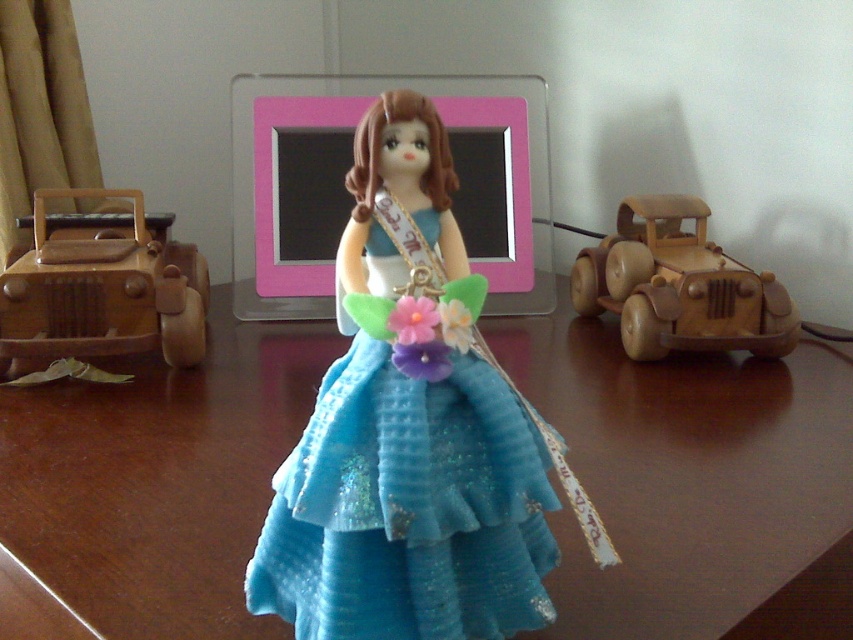
Is glittery blue fabric dress at center closer to the viewer compared to wooden car at right?

Yes.

Which is behind, point (439, 467) or point (782, 316)?

Point (782, 316)

Locate an element on the screen. The width and height of the screenshot is (853, 640). glittery blue fabric dress at center is located at coordinates [408, 508].

Which is behind, point (749, 465) or point (520, 456)?

Positioned behind is point (749, 465).

Is wooden table at center further to the viewer compared to glittery blue fabric dress at center?

Yes.

Identify the location of wooden table at center. The image size is (853, 640). (694, 483).

Is glittery blue fabric dress at center further to camera compared to wooden toy car at left?

No, glittery blue fabric dress at center is closer to the viewer.

Image resolution: width=853 pixels, height=640 pixels. I want to click on glittery blue fabric dress at center, so click(x=408, y=508).